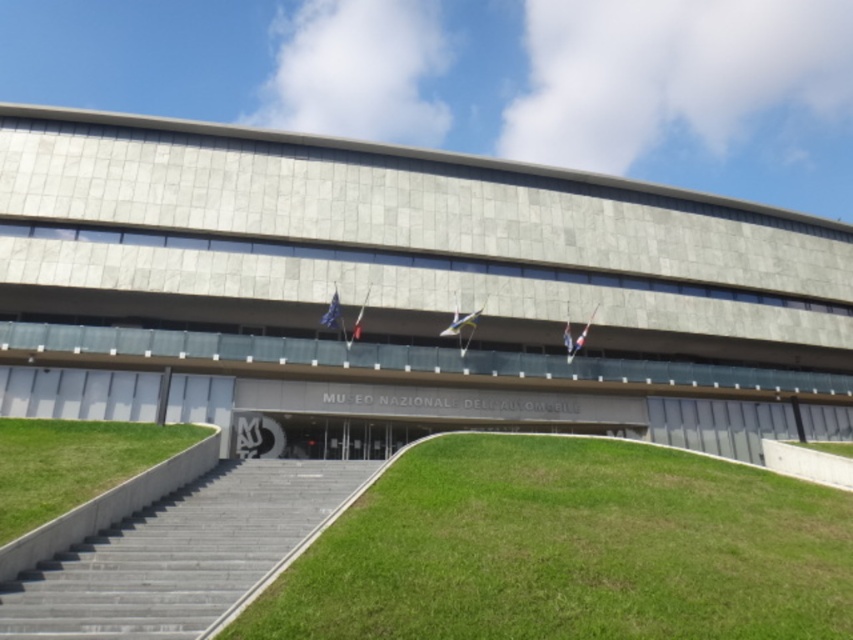
You are standing in front of the Museo Nazionale dellAutomobile and want to walk towards the entrance. Which area of the green grass at lower center and green grass at lower left has taller grass that might slow down your walking?

The green grass at lower center has a greater height compared to green grass at lower left, so the green grass at lower center has taller grass that might slow down your walking.

You are standing at the entrance of the Museo Nazionale dellAutomobile and want to locate the gray concrete stairs at center. According to the coordinates provided, where should you look to find them?

The gray concrete stairs at center are located at point 0.867 on the x axis and 0.211 on the y axis.